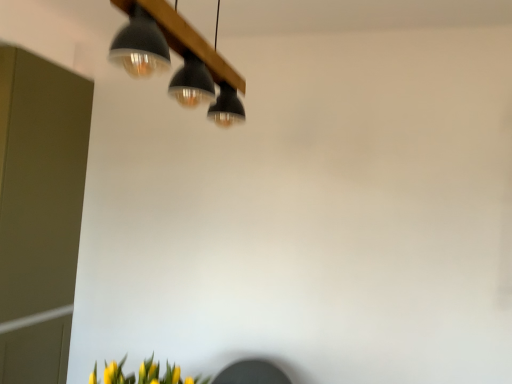
I want to click on matte black lampshade at upper center, so click(x=180, y=55).

Describe the element at coordinates (180, 55) in the screenshot. I see `matte black lampshade at upper center` at that location.

Measure the distance between matte black lampshade at upper center and camera.

The distance of matte black lampshade at upper center from camera is 37.51 inches.

Identify the location of matte black lampshade at upper center. (180, 55).